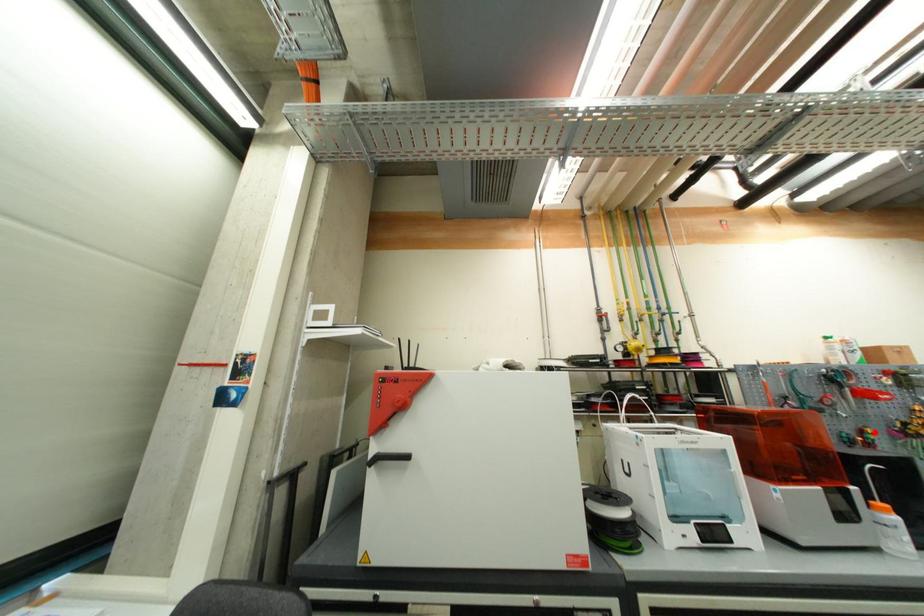
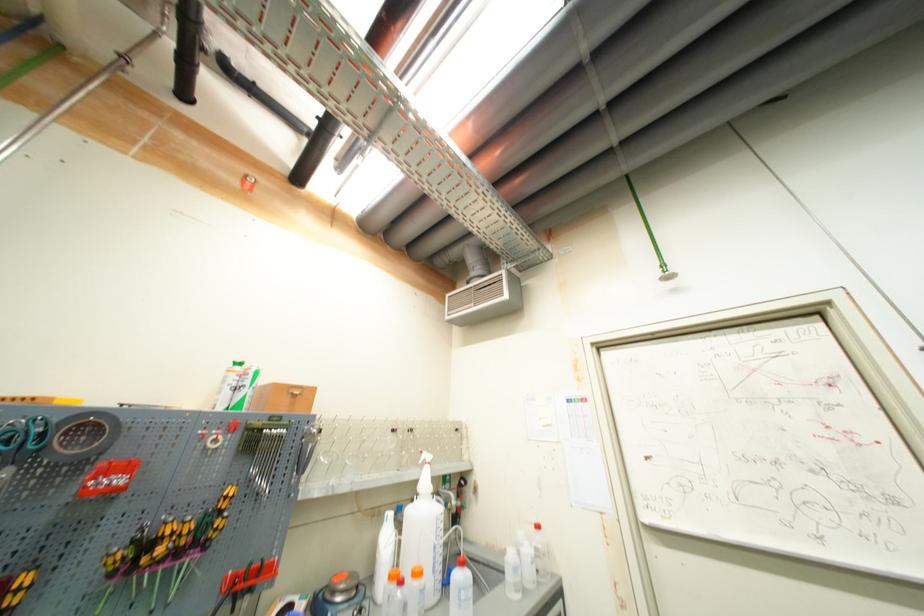
In the second image, find the point that corresponds to the highlighted location in the first image.

(30, 581)